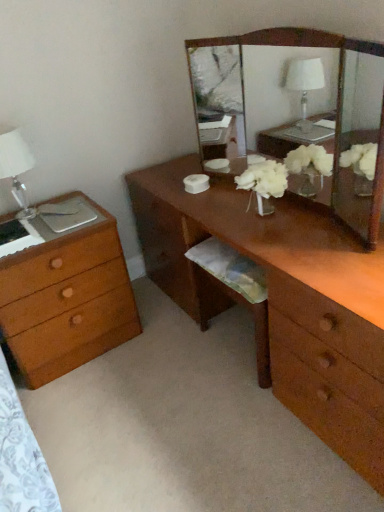
Find the location of a particular element. vacant region above wooden chest of drawers at left (from a real-world perspective) is located at coordinates (36, 219).